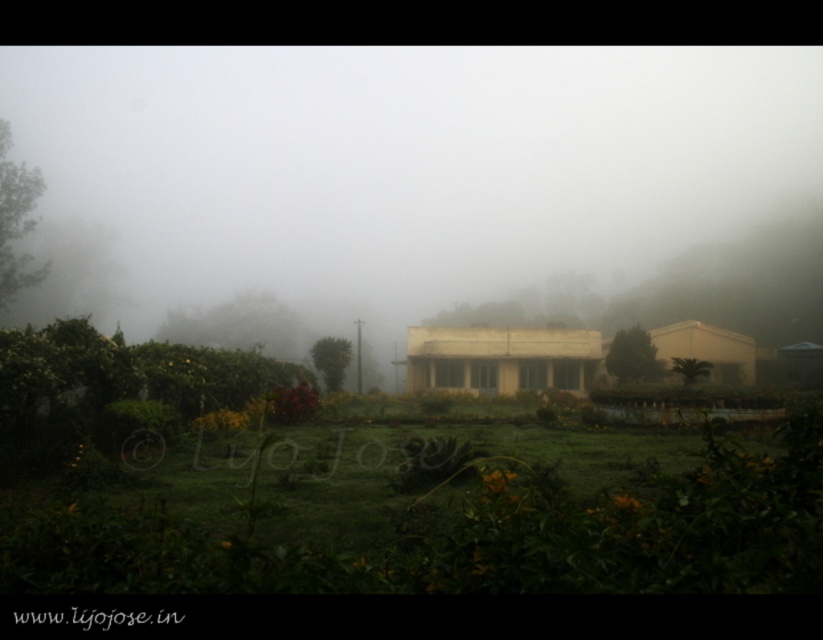
You are standing at the point marked by point (394,170) in the image. What is the nearest object to you in the scene?

The nearest object to you is the foggy white building at center represented by point (394,170).